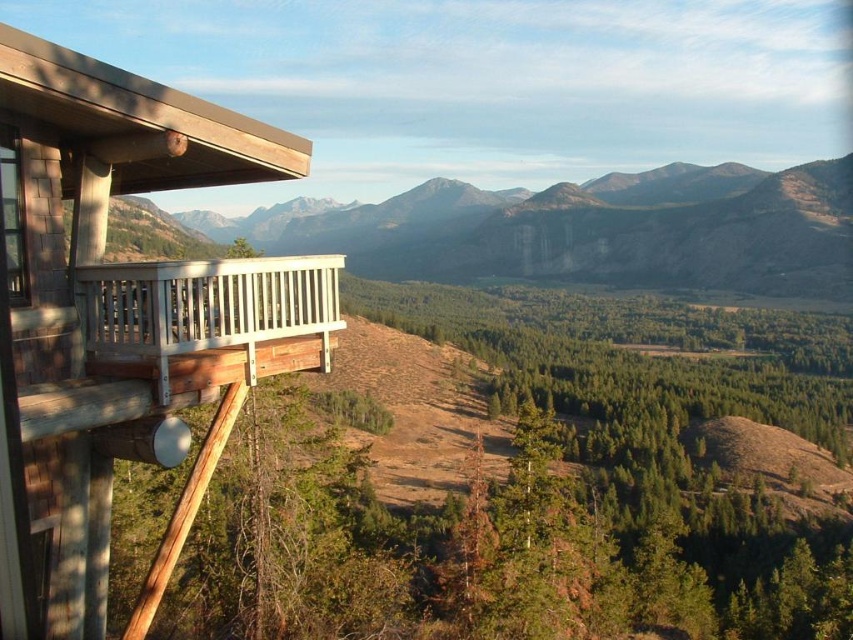
You are standing on the wooden cabin at left and want to move to the white wood balcony at upper left. Which direction should you move to reach it?

The wooden cabin at left is smaller than the white wood balcony at upper left, so you should move towards the upper left direction to reach it.

You are standing on the wooden cabin at left and want to move to the white wood balcony at upper left. Which direction should you move to reach it?

The wooden cabin at left is taller than the white wood balcony at upper left, so you should move downward to reach it.

You are standing on the wooden balcony and want to locate the wooden cabin at left. According to the coordinates provided, where should you look relative to your position?

The wooden cabin at left is located at coordinates 0.502 on the x axis and 0.144 on the y axis relative to your position on the balcony.